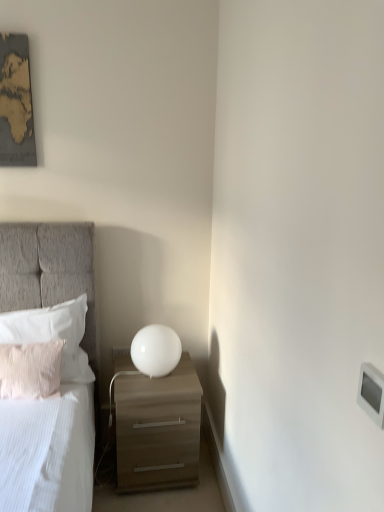
The image size is (384, 512). Identify the location of free location to the right of white glossy sphere at center. (187, 376).